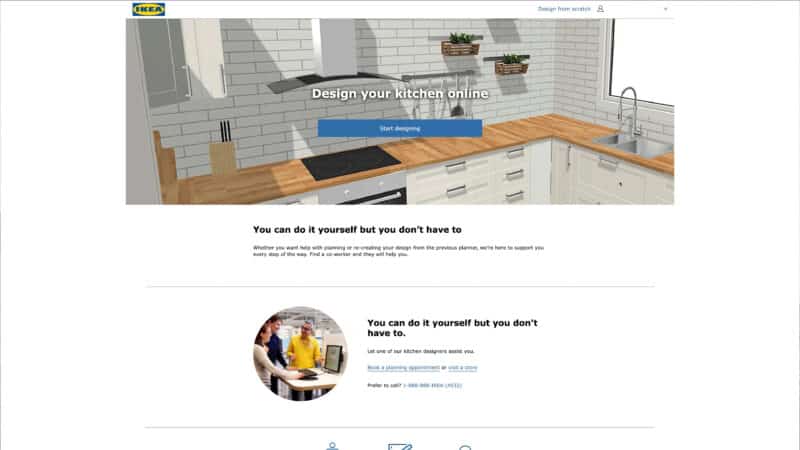
Locate an element on the screen. The image size is (800, 450). monitor is located at coordinates (334, 361).